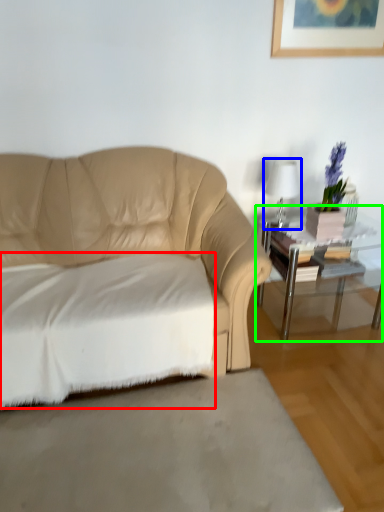
Question: Which object is the farthest from sheet (highlighted by a red box)? Choose among these: table lamp (highlighted by a blue box) or table (highlighted by a green box).

Choices:
 (A) table lamp
 (B) table

Answer: (A)